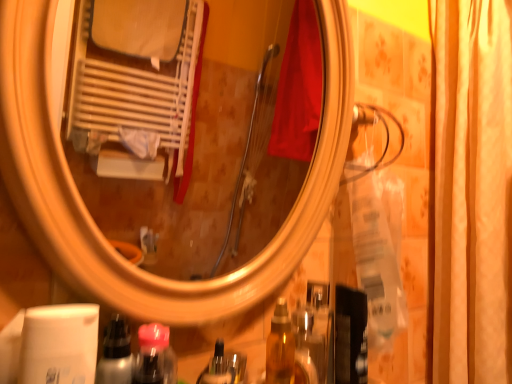
At what (x,y) coordinates should I click in order to perform the action: click on silky beige curtain at right. Please return your answer as a coordinate pair (x, y). The width and height of the screenshot is (512, 384). Looking at the image, I should click on (472, 191).

At what (x,y) coordinates should I click in order to perform the action: click on translucent plastic bottle at lower center. Please return your answer as a coordinate pair (x, y). This screenshot has height=384, width=512. Looking at the image, I should click on (154, 356).

This screenshot has height=384, width=512. What are the coordinates of `metallic silver spray at lower left` in the screenshot? It's located at (x=115, y=354).

Which is more to the left, silky beige curtain at right or metallic silver spray at lower left?

metallic silver spray at lower left is more to the left.

Is silky beige curtain at right far away from metallic silver spray at lower left?

No, silky beige curtain at right is not far from metallic silver spray at lower left.

Can you confirm if silky beige curtain at right is shorter than metallic silver spray at lower left?

No.

Considering the relative sizes of silky beige curtain at right and metallic silver spray at lower left in the image provided, is silky beige curtain at right smaller than metallic silver spray at lower left?

Actually, silky beige curtain at right might be larger than metallic silver spray at lower left.

Is metallic silver spray at lower left wider than translucent plastic bottle at lower center?

Yes.

From the image's perspective, is metallic silver spray at lower left on top of translucent plastic bottle at lower center?

Yes, from the image's perspective, metallic silver spray at lower left is above translucent plastic bottle at lower center.

Does metallic silver spray at lower left turn towards translucent plastic bottle at lower center?

No, metallic silver spray at lower left is not facing towards translucent plastic bottle at lower center.

Considering the positions of point (96, 375) and point (166, 328), is point (96, 375) closer or farther from the camera than point (166, 328)?

Clearly, point (96, 375) is closer to the camera than point (166, 328).

Considering the positions of objects translucent plastic bottle at lower center and metallic silver spray at lower left in the image provided, who is more to the right, translucent plastic bottle at lower center or metallic silver spray at lower left?

translucent plastic bottle at lower center.

Locate an element on the screen. bottle located above the translucent plastic bottle at lower center (from a real-world perspective) is located at coordinates (115, 354).

Considering the relative sizes of translucent plastic bottle at lower center and metallic silver spray at lower left in the image provided, is translucent plastic bottle at lower center bigger than metallic silver spray at lower left?

Actually, translucent plastic bottle at lower center might be smaller than metallic silver spray at lower left.

From the image's perspective, is silky beige curtain at right above translucent plastic bottle at lower center?

Indeed, from the image's perspective, silky beige curtain at right is shown above translucent plastic bottle at lower center.

From a real-world perspective, is silky beige curtain at right physically above translucent plastic bottle at lower center?

Yes, from a real-world perspective, silky beige curtain at right is above translucent plastic bottle at lower center.

Considering the relative sizes of silky beige curtain at right and translucent plastic bottle at lower center in the image provided, is silky beige curtain at right thinner than translucent plastic bottle at lower center?

In fact, silky beige curtain at right might be wider than translucent plastic bottle at lower center.

Could you tell me if silky beige curtain at right is turned towards translucent plastic bottle at lower center?

Yes, silky beige curtain at right is turned towards translucent plastic bottle at lower center.

Does metallic silver spray at lower left have a greater height compared to silky beige curtain at right?

Incorrect, the height of metallic silver spray at lower left is not larger of that of silky beige curtain at right.

Considering the sizes of metallic silver spray at lower left and silky beige curtain at right in the image, is metallic silver spray at lower left bigger or smaller than silky beige curtain at right?

metallic silver spray at lower left is smaller than silky beige curtain at right.

In the scene shown: Is silky beige curtain at right completely or partially inside metallic silver spray at lower left?

No, silky beige curtain at right is not surrounded by metallic silver spray at lower left.

Considering the points (119, 367) and (473, 62), which point is behind, point (119, 367) or point (473, 62)?

The point (473, 62) is behind.

Is translucent plastic bottle at lower center shorter than silky beige curtain at right?

Yes.

How different are the orientations of translucent plastic bottle at lower center and silky beige curtain at right in degrees?

89.7 degrees separate the facing orientations of translucent plastic bottle at lower center and silky beige curtain at right.

Is translucent plastic bottle at lower center far from silky beige curtain at right?

That's not correct — translucent plastic bottle at lower center is a little close to silky beige curtain at right.

Image resolution: width=512 pixels, height=384 pixels. I want to click on mouthwash in front of the silky beige curtain at right, so click(154, 356).

I want to click on shower curtain that is above the metallic silver spray at lower left (from the image's perspective), so click(472, 191).

At what (x,y) coordinates should I click in order to perform the action: click on mouthwash that appears below the metallic silver spray at lower left (from the image's perspective). Please return your answer as a coordinate pair (x, y). Looking at the image, I should click on (154, 356).

Looking at the image, which one is located closer to translucent plastic bottle at lower center, silky beige curtain at right or metallic silver spray at lower left?

Among the two, metallic silver spray at lower left is located nearer to translucent plastic bottle at lower center.

From the image, which object appears to be farther from silky beige curtain at right, metallic silver spray at lower left or translucent plastic bottle at lower center?

Among the two, metallic silver spray at lower left is located further to silky beige curtain at right.

Which object lies nearer to the anchor point translucent plastic bottle at lower center, metallic silver spray at lower left or silky beige curtain at right?

Based on the image, metallic silver spray at lower left appears to be nearer to translucent plastic bottle at lower center.

When comparing their distances from metallic silver spray at lower left, does silky beige curtain at right or translucent plastic bottle at lower center seem closer?

Based on the image, translucent plastic bottle at lower center appears to be nearer to metallic silver spray at lower left.

From the image, which object appears to be nearer to silky beige curtain at right, translucent plastic bottle at lower center or metallic silver spray at lower left?

The object closer to silky beige curtain at right is translucent plastic bottle at lower center.

Estimate the real-world distances between objects in this image. Which object is further from metallic silver spray at lower left, translucent plastic bottle at lower center or silky beige curtain at right?

silky beige curtain at right.

The image size is (512, 384). In order to click on mouthwash between metallic silver spray at lower left and silky beige curtain at right in this screenshot , I will do `click(154, 356)`.